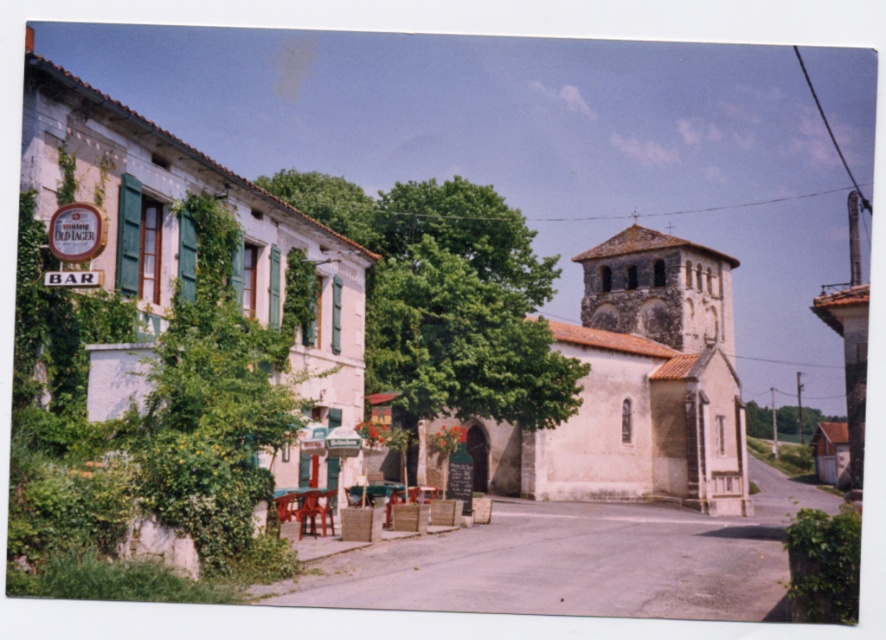
Does wooden table at center appear on the left side of wooden chair at center?

Yes, wooden table at center is to the left of wooden chair at center.

Does wooden table at center appear under wooden chair at center?

Incorrect, wooden table at center is not positioned below wooden chair at center.

The width and height of the screenshot is (886, 640). What are the coordinates of `wooden table at center` in the screenshot? It's located at (305, 508).

Where is `wooden table at center`? The height and width of the screenshot is (640, 886). wooden table at center is located at coordinates (305, 508).

Can you confirm if green leafy tree at right is shorter than wooden chair at center?

No.

Between point (760, 424) and point (324, 497), which one is positioned behind?

The point (760, 424) is behind.

Identify the location of green leafy tree at right. (758, 420).

Where is `green leafy tree at right`? This screenshot has height=640, width=886. green leafy tree at right is located at coordinates (758, 420).

Find the location of `green leafy tree at right`. green leafy tree at right is located at coordinates (758, 420).

Can you confirm if green leafy tree at right is thinner than wooden table at center?

In fact, green leafy tree at right might be wider than wooden table at center.

Where is `green leafy tree at right`? The height and width of the screenshot is (640, 886). green leafy tree at right is located at coordinates (758, 420).

Image resolution: width=886 pixels, height=640 pixels. In order to click on green leafy tree at right in this screenshot , I will do `click(758, 420)`.